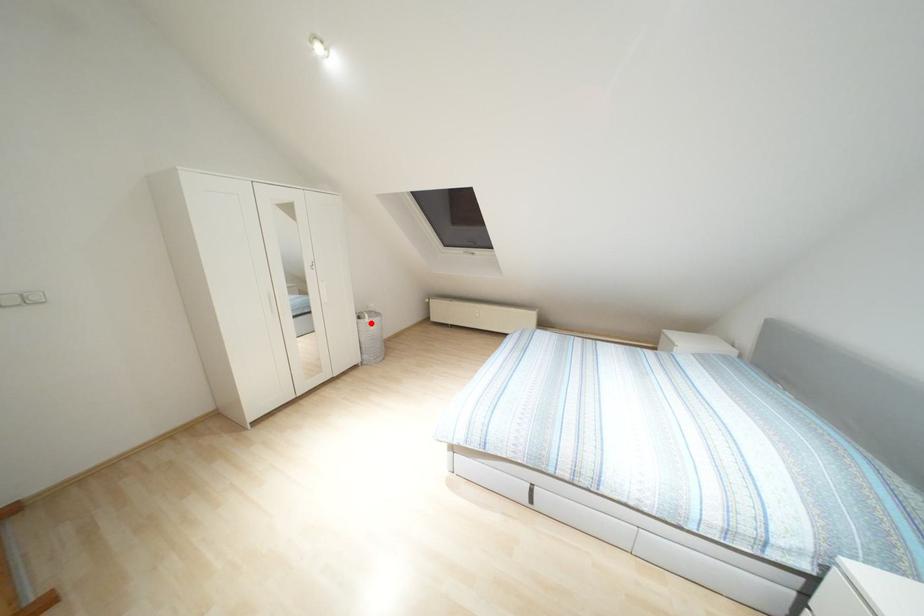
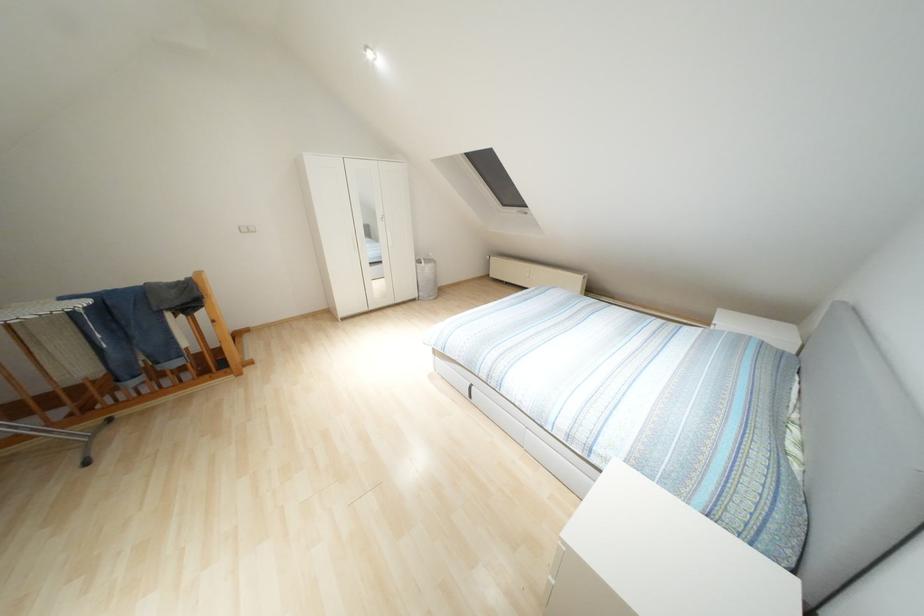
Locate, in the second image, the point that corresponds to the highlighted location in the first image.

(426, 268)